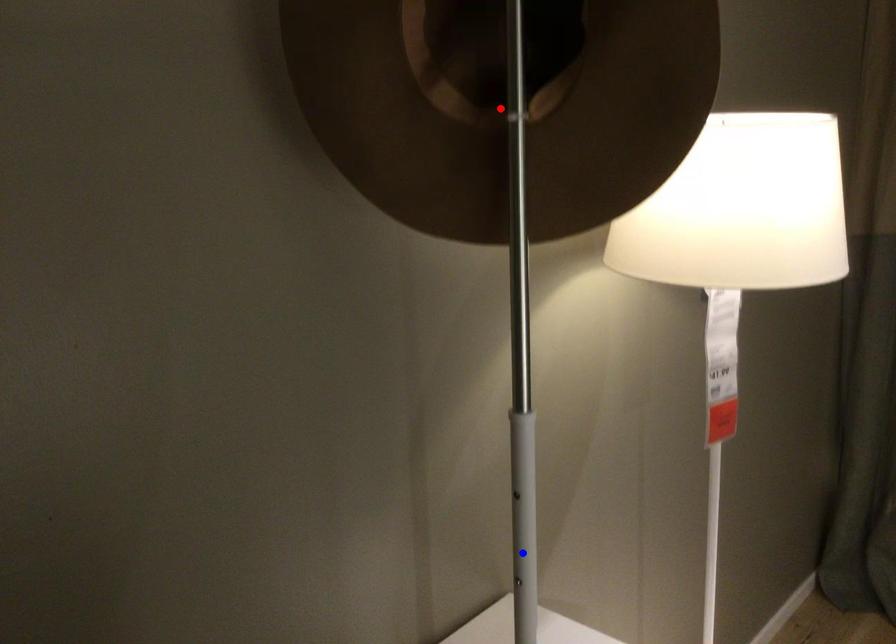
Question: Which of the two points in the image is closer to the camera?

Choices:
 (A) Blue point is closer.
 (B) Red point is closer.

Answer: (B)